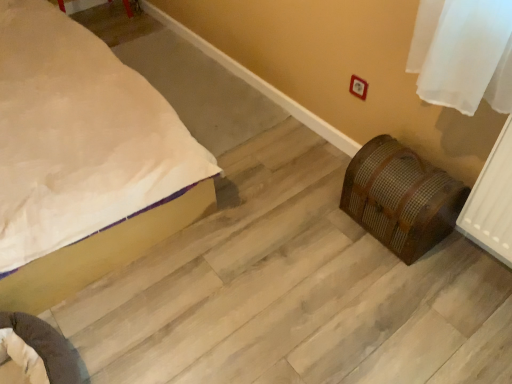
Question: Does white matte bed at lower left lie behind brown woven chest at lower right?

Choices:
 (A) no
 (B) yes

Answer: (A)

Question: Can you confirm if white matte bed at lower left is bigger than brown woven chest at lower right?

Choices:
 (A) no
 (B) yes

Answer: (B)

Question: Can you confirm if white matte bed at lower left is shorter than brown woven chest at lower right?

Choices:
 (A) no
 (B) yes

Answer: (A)

Question: Does white matte bed at lower left touch brown woven chest at lower right?

Choices:
 (A) no
 (B) yes

Answer: (A)

Question: From a real-world perspective, is white matte bed at lower left physically below brown woven chest at lower right?

Choices:
 (A) yes
 (B) no

Answer: (B)

Question: From a real-world perspective, does white matte bed at lower left stand above brown woven chest at lower right?

Choices:
 (A) no
 (B) yes

Answer: (B)

Question: Is brown woven chest at lower right positioned in front of white matte bed at lower left?

Choices:
 (A) yes
 (B) no

Answer: (B)

Question: From the image's perspective, is brown woven chest at lower right on white matte bed at lower left?

Choices:
 (A) yes
 (B) no

Answer: (B)

Question: From a real-world perspective, does brown woven chest at lower right sit lower than white matte bed at lower left?

Choices:
 (A) yes
 (B) no

Answer: (A)

Question: From a real-world perspective, is brown woven chest at lower right on top of white matte bed at lower left?

Choices:
 (A) yes
 (B) no

Answer: (B)

Question: Is brown woven chest at lower right smaller than white matte bed at lower left?

Choices:
 (A) yes
 (B) no

Answer: (A)

Question: Considering the relative sizes of brown woven chest at lower right and white matte bed at lower left in the image provided, is brown woven chest at lower right thinner than white matte bed at lower left?

Choices:
 (A) no
 (B) yes

Answer: (B)

Question: Is point (430, 221) positioned closer to the camera than point (6, 306)?

Choices:
 (A) closer
 (B) farther

Answer: (B)